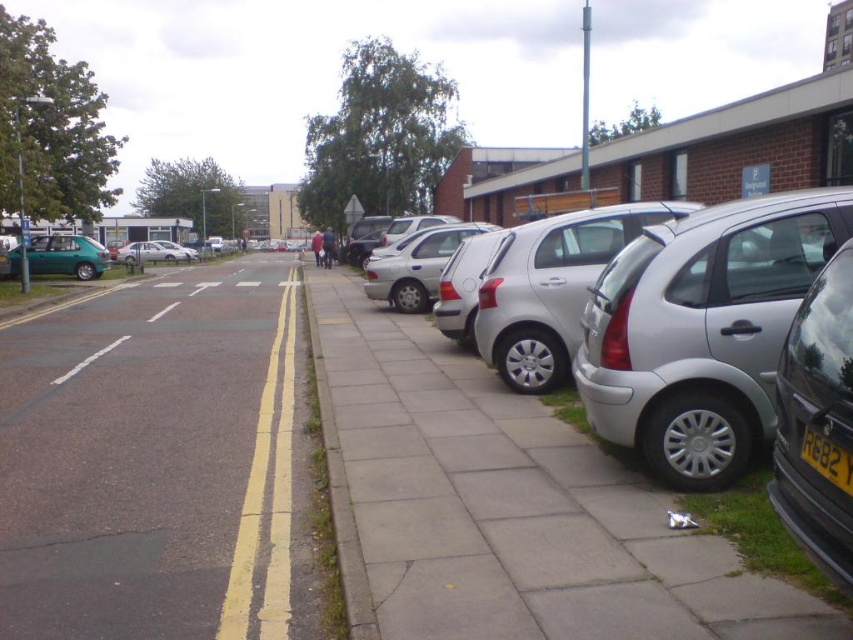
Who is lower down, gray concrete pavement at right or yellow matte license plate at center-right?

gray concrete pavement at right is below.

Describe the element at coordinates (505, 508) in the screenshot. This screenshot has width=853, height=640. I see `gray concrete pavement at right` at that location.

Find the location of a particular element. gray concrete pavement at right is located at coordinates (505, 508).

Is yellow asphalt road at center above metallic silver car at right?

No, yellow asphalt road at center is not above metallic silver car at right.

Is yellow asphalt road at center bigger than metallic silver car at right?

Correct, yellow asphalt road at center is larger in size than metallic silver car at right.

Which is behind, point (16, 392) or point (780, 452)?

Positioned behind is point (16, 392).

This screenshot has width=853, height=640. Find the location of `yellow asphalt road at center`. yellow asphalt road at center is located at coordinates (149, 460).

Who is more distant from viewer, (764, 365) or (407, 296)?

The point (407, 296) is behind.

The height and width of the screenshot is (640, 853). I want to click on silver metallic hatchback at right, so click(x=701, y=330).